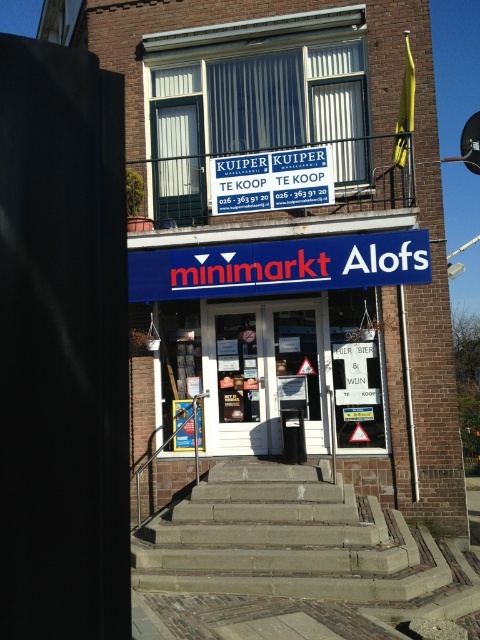
Who is more distant from viewer, (396, 573) or (216, 212)?

Point (216, 212)

Does point (162, 556) lie in front of point (312, 193)?

Yes.

Image resolution: width=480 pixels, height=640 pixels. I want to click on brown stone stairs at center, so click(285, 540).